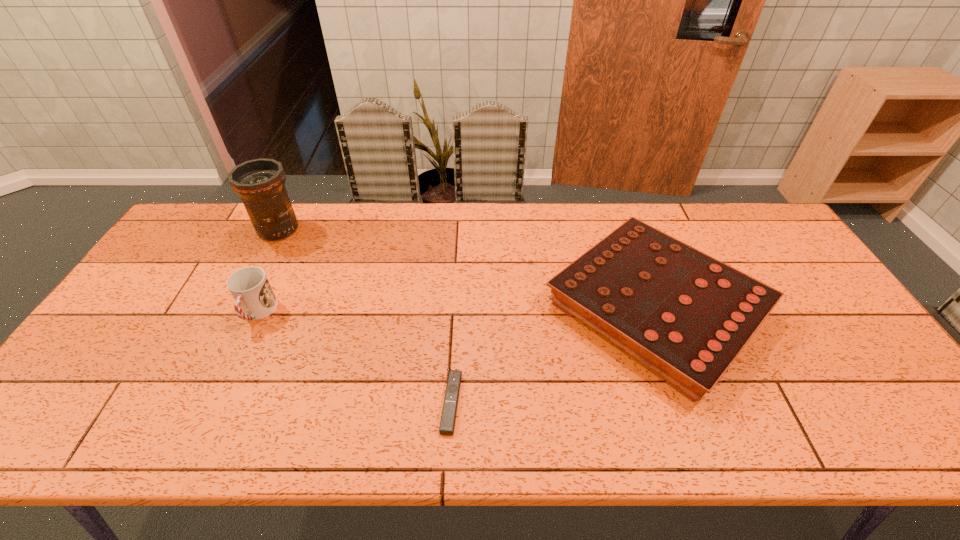
The image size is (960, 540). I want to click on blank region between the second shortest object and the shortest object, so click(553, 355).

I want to click on vacant region between the shortest object and the telephoto lens, so [x=365, y=315].

Locate an element on the screen. The height and width of the screenshot is (540, 960). unoccupied position between the telephoto lens and the third object from left to right is located at coordinates (365, 315).

Where is `unoccupied position between the remote control and the cup`? The height and width of the screenshot is (540, 960). unoccupied position between the remote control and the cup is located at coordinates (354, 357).

You are a GUI agent. You are given a task and a screenshot of the screen. Output one action in this format:
    pyautogui.click(x=<x>, y=<y>)
    Task: Click on the vacant space that's between the cup and the shortest object
    The height and width of the screenshot is (540, 960).
    Given the screenshot: What is the action you would take?
    pyautogui.click(x=354, y=357)

The height and width of the screenshot is (540, 960). In order to click on free space that is in between the gameboard and the third shortest object in this screenshot , I will do `click(457, 310)`.

At what (x,y) coordinates should I click in order to perform the action: click on vacant area between the remote control and the rightmost object. Please return your answer as a coordinate pair (x, y). The width and height of the screenshot is (960, 540). Looking at the image, I should click on (553, 355).

This screenshot has height=540, width=960. I want to click on unoccupied position between the gameboard and the telephoto lens, so click(x=467, y=269).

Identify the location of vacant space in between the third shortest object and the telephoto lens. (268, 271).

Locate which object ranks in proximity to the telephoto lens. Please provide its 2D coordinates. Your answer should be formatted as a tuple, i.e. [(x, y)], where the tuple contains the x and y coordinates of a point satisfying the conditions above.

[(254, 298)]